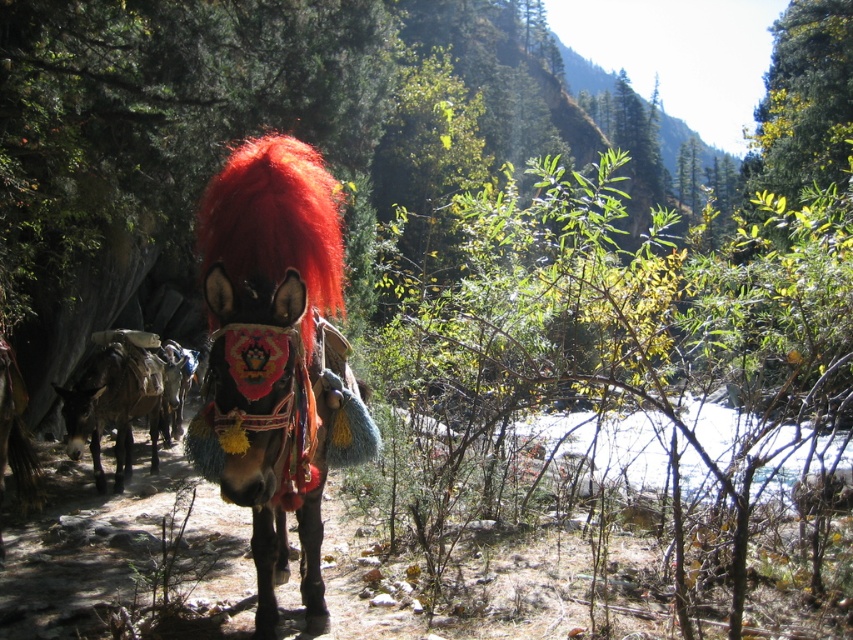
Question: Is shiny red mane at center below shiny blue fabric mule at center?

Choices:
 (A) no
 (B) yes

Answer: (A)

Question: Which point is closer to the camera?

Choices:
 (A) dark brown leather donkey at left
 (B) shiny black donkey at center

Answer: (B)

Question: Does shiny black donkey at center have a lesser width compared to dark brown leather donkey at left?

Choices:
 (A) no
 (B) yes

Answer: (B)

Question: Which is farther from the dark brown leather donkey at left?

Choices:
 (A) shiny blue fabric mule at center
 (B) shiny red mane at center

Answer: (B)

Question: Does shiny black donkey at center have a larger size compared to shiny red mane at center?

Choices:
 (A) no
 (B) yes

Answer: (B)

Question: Which of the following is the closest to the observer?

Choices:
 (A) (163, 413)
 (B) (125, 477)
 (C) (311, 244)
 (D) (316, 592)

Answer: (C)